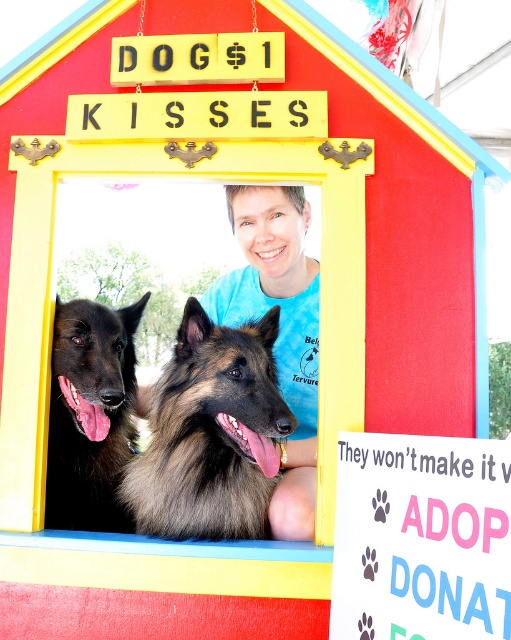
Does point (308, 516) come in front of point (82, 484)?

That is True.

Is the position of blue cotton shirt at center less distant than that of black fur dog at center?

Yes, blue cotton shirt at center is closer to the viewer.

Is point (241, 218) closer to viewer compared to point (127, 515)?

No, it is behind (127, 515).

I want to click on blue cotton shirt at center, so click(x=280, y=330).

Between point (164, 416) and point (102, 486), which one is positioned in front?

Point (164, 416) is in front.

Does brown shaggy dog at center have a lesser height compared to black fur dog at center?

Correct, brown shaggy dog at center is not as tall as black fur dog at center.

The image size is (511, 640). Find the location of `brown shaggy dog at center`. brown shaggy dog at center is located at coordinates (211, 433).

Image resolution: width=511 pixels, height=640 pixels. I want to click on brown shaggy dog at center, so click(x=211, y=433).

Does point (131, 481) come behind point (281, 502)?

Yes, it is behind point (281, 502).

Is point (234, 536) behind point (299, 436)?

No, it is in front of (299, 436).

Identify the location of brown shaggy dog at center. (211, 433).